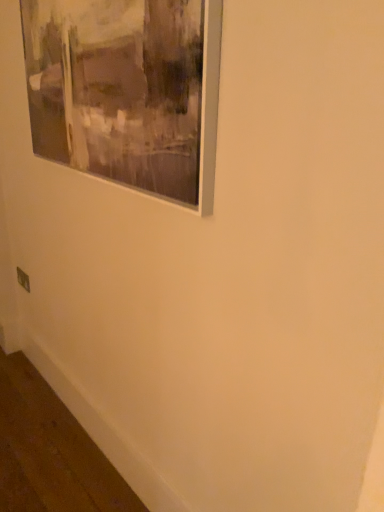
I want to click on matte gray picture frame at upper left, so click(127, 91).

Describe the element at coordinates (127, 91) in the screenshot. I see `matte gray picture frame at upper left` at that location.

What do you see at coordinates (23, 279) in the screenshot? Image resolution: width=384 pixels, height=512 pixels. I see `metallic gray outlet at lower left` at bounding box center [23, 279].

Locate an element on the screen. The image size is (384, 512). metallic gray outlet at lower left is located at coordinates (23, 279).

This screenshot has width=384, height=512. I want to click on matte gray picture frame at upper left, so click(x=127, y=91).

Is metallic gray outlet at lower left at the right side of matte gray picture frame at upper left?

No, metallic gray outlet at lower left is not to the right of matte gray picture frame at upper left.

Relative to matte gray picture frame at upper left, is metallic gray outlet at lower left in front or behind?

metallic gray outlet at lower left is positioned farther from the viewer than matte gray picture frame at upper left.

Does point (24, 277) lie in front of point (31, 63)?

No.

From the image's perspective, which one is positioned higher, metallic gray outlet at lower left or matte gray picture frame at upper left?

matte gray picture frame at upper left.

From a real-world perspective, is metallic gray outlet at lower left above or below matte gray picture frame at upper left?

Clearly, from a real-world perspective, metallic gray outlet at lower left is below matte gray picture frame at upper left.

Considering the sizes of objects metallic gray outlet at lower left and matte gray picture frame at upper left in the image provided, who is wider, metallic gray outlet at lower left or matte gray picture frame at upper left?

With larger width is matte gray picture frame at upper left.

Is metallic gray outlet at lower left shorter than matte gray picture frame at upper left?

Indeed, metallic gray outlet at lower left has a lesser height compared to matte gray picture frame at upper left.

Consider the image. Does metallic gray outlet at lower left have a smaller size compared to matte gray picture frame at upper left?

Yes, metallic gray outlet at lower left is smaller than matte gray picture frame at upper left.

Is metallic gray outlet at lower left inside or outside of matte gray picture frame at upper left?

metallic gray outlet at lower left is outside matte gray picture frame at upper left.

Is metallic gray outlet at lower left not close to matte gray picture frame at upper left?

metallic gray outlet at lower left is far away from matte gray picture frame at upper left.

Based on the photo, is metallic gray outlet at lower left looking in the opposite direction of matte gray picture frame at upper left?

No, matte gray picture frame at upper left is not at the back of metallic gray outlet at lower left.

Locate an element on the screen. picture frame that appears on the right of metallic gray outlet at lower left is located at coordinates (127, 91).

Considering the positions of objects matte gray picture frame at upper left and metallic gray outlet at lower left in the image provided, who is more to the right, matte gray picture frame at upper left or metallic gray outlet at lower left?

matte gray picture frame at upper left is more to the right.

In the image, is matte gray picture frame at upper left positioned in front of or behind metallic gray outlet at lower left?

In the image, matte gray picture frame at upper left appears in front of metallic gray outlet at lower left.

Does point (164, 28) come behind point (19, 274)?

That is False.

From the image's perspective, is matte gray picture frame at upper left over metallic gray outlet at lower left?

Yes, from the image's perspective, matte gray picture frame at upper left is above metallic gray outlet at lower left.

From a real-world perspective, which is physically below, matte gray picture frame at upper left or metallic gray outlet at lower left?

metallic gray outlet at lower left.

Considering the sizes of objects matte gray picture frame at upper left and metallic gray outlet at lower left in the image provided, who is thinner, matte gray picture frame at upper left or metallic gray outlet at lower left?

Thinner between the two is metallic gray outlet at lower left.

In the scene shown: Considering the sizes of objects matte gray picture frame at upper left and metallic gray outlet at lower left in the image provided, who is taller, matte gray picture frame at upper left or metallic gray outlet at lower left?

matte gray picture frame at upper left.

Between matte gray picture frame at upper left and metallic gray outlet at lower left, which one has larger size?

matte gray picture frame at upper left.

Is matte gray picture frame at upper left inside the boundaries of metallic gray outlet at lower left, or outside?

matte gray picture frame at upper left cannot be found inside metallic gray outlet at lower left.

Is matte gray picture frame at upper left far away from metallic gray outlet at lower left?

That's right, there is a large distance between matte gray picture frame at upper left and metallic gray outlet at lower left.

Is metallic gray outlet at lower left at the back of matte gray picture frame at upper left?

No, matte gray picture frame at upper left is not facing away from metallic gray outlet at lower left.

What's the angular difference between matte gray picture frame at upper left and metallic gray outlet at lower left's facing directions?

matte gray picture frame at upper left and metallic gray outlet at lower left are facing 0.0728 degrees away from each other.

You are a GUI agent. You are given a task and a screenshot of the screen. Output one action in this format:
    pyautogui.click(x=<x>, y=<y>)
    Task: Click on the picture frame on the right of metallic gray outlet at lower left
    
    Given the screenshot: What is the action you would take?
    pyautogui.click(x=127, y=91)

Where is `picture frame in front of the metallic gray outlet at lower left`? picture frame in front of the metallic gray outlet at lower left is located at coordinates (127, 91).

Find the location of `electric outlet that is below the matte gray picture frame at upper left (from the image's perspective)`. electric outlet that is below the matte gray picture frame at upper left (from the image's perspective) is located at coordinates (23, 279).